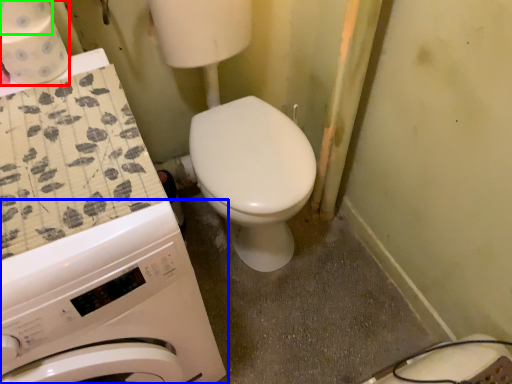
Question: Which object is the farthest from toilet paper (highlighted by a red box)? Choose among these: washing machine (highlighted by a blue box) or toilet paper (highlighted by a green box).

Choices:
 (A) washing machine
 (B) toilet paper

Answer: (A)